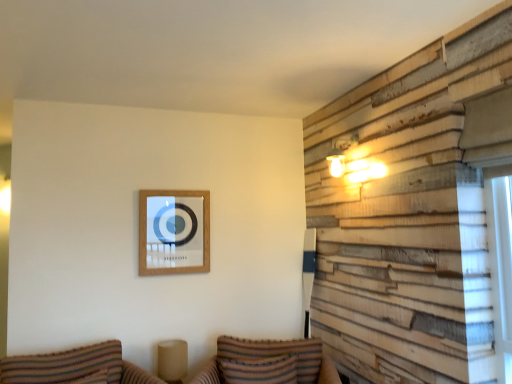
This screenshot has height=384, width=512. Identify the location of striped fabric couch at lower left, acting as the first couch starting from the left. (75, 367).

Describe the element at coordinates (269, 359) in the screenshot. Image resolution: width=512 pixels, height=384 pixels. I see `striped fabric couch at lower center, the 2th couch when ordered from left to right` at that location.

You are a GUI agent. You are given a task and a screenshot of the screen. Output one action in this format:
    pyautogui.click(x=<x>, y=<y>)
    Task: Click on the wooden picture frame at upper center
    
    Given the screenshot: What is the action you would take?
    pyautogui.click(x=174, y=232)

Image resolution: width=512 pixels, height=384 pixels. In order to click on striped fabric couch at lower left, acting as the first couch starting from the left in this screenshot , I will do `click(75, 367)`.

Is striped fabric pillow at lower center a part of striped fabric couch at lower center, which is the first couch in right-to-left order?

Yes, striped fabric couch at lower center, which is the first couch in right-to-left order, is surrounding striped fabric pillow at lower center.

Is striped fabric couch at lower center, the 2th couch when ordered from left to right, wider than striped fabric pillow at lower center?

Correct, the width of striped fabric couch at lower center, the 2th couch when ordered from left to right, exceeds that of striped fabric pillow at lower center.

Does point (240, 346) appear closer or farther from the camera than point (252, 373)?

Point (240, 346).

From the image's perspective, which is above, striped fabric couch at lower center, the 2th couch when ordered from left to right, or striped fabric pillow at lower center?

striped fabric pillow at lower center is shown above in the image.

The image size is (512, 384). Find the location of `picture frame behind the striped fabric pillow at lower center`. picture frame behind the striped fabric pillow at lower center is located at coordinates (174, 232).

Is striped fabric pillow at lower center located outside wooden picture frame at upper center?

That's correct, striped fabric pillow at lower center is outside of wooden picture frame at upper center.

From the picture: Which is further, (291,354) or (192,262)?

The point (192,262) is behind.

From the image's perspective, between striped fabric pillow at lower center and wooden picture frame at upper center, who is located below?

From the image's view, striped fabric pillow at lower center is below.

Would you consider wooden picture frame at upper center to be distant from striped fabric couch at lower center, the 2th couch when ordered from left to right?

That's not correct — wooden picture frame at upper center is a little close to striped fabric couch at lower center, the 2th couch when ordered from left to right.

Between wooden picture frame at upper center and striped fabric couch at lower center, the 2th couch when ordered from left to right, which one has larger size?

striped fabric couch at lower center, the 2th couch when ordered from left to right, is bigger.

I want to click on couch that is the 1st one when counting forward from the wooden picture frame at upper center, so click(269, 359).

Could you tell me if wooden picture frame at upper center is facing striped fabric couch at lower center, which is the first couch in right-to-left order?

No, wooden picture frame at upper center does not turn towards striped fabric couch at lower center, which is the first couch in right-to-left order.

Is striped fabric couch at lower left, acting as the first couch starting from the left, facing towards wooden picture frame at upper center?

No.

In terms of size, does striped fabric couch at lower left, acting as the first couch starting from the left, appear bigger or smaller than wooden picture frame at upper center?

Clearly, striped fabric couch at lower left, acting as the first couch starting from the left, is larger in size than wooden picture frame at upper center.

In the scene shown: Which is closer, (140, 370) or (169, 253)?

Clearly, point (140, 370) is closer to the camera than point (169, 253).

From the image's perspective, which one is positioned lower, striped fabric couch at lower left, which is counted as the 2th couch, starting from the right, or wooden picture frame at upper center?

striped fabric couch at lower left, which is counted as the 2th couch, starting from the right.

From a real-world perspective, which object rests below the other?

striped fabric pillow at lower center, from a real-world perspective.

Can we say wooden picture frame at upper center lies outside striped fabric pillow at lower center?

Yes, wooden picture frame at upper center is not within striped fabric pillow at lower center.

Visually, is wooden picture frame at upper center positioned to the left or to the right of striped fabric pillow at lower center?

From the image, it's evident that wooden picture frame at upper center is to the left of striped fabric pillow at lower center.

At what (x,y) coordinates should I click in order to perform the action: click on picture frame behind the striped fabric pillow at lower center. Please return your answer as a coordinate pair (x, y). The image size is (512, 384). Looking at the image, I should click on (174, 232).

Which of these two, striped fabric pillow at lower center or striped fabric couch at lower center, the 2th couch when ordered from left to right, is wider?

striped fabric couch at lower center, the 2th couch when ordered from left to right, is wider.

Is striped fabric pillow at lower center directly adjacent to striped fabric couch at lower center, which is the first couch in right-to-left order?

Yes, striped fabric pillow at lower center is in contact with striped fabric couch at lower center, which is the first couch in right-to-left order.

Considering their positions, is striped fabric pillow at lower center located in front of or behind striped fabric couch at lower center, the 2th couch when ordered from left to right?

striped fabric pillow at lower center is positioned farther from the viewer than striped fabric couch at lower center, the 2th couch when ordered from left to right.

Which is closer to the camera, (296, 362) or (205, 271)?

The point (296, 362) is closer to the camera.

Looking at this image, how different are the orientations of striped fabric couch at lower center, which is the first couch in right-to-left order, and wooden picture frame at upper center in degrees?

26.3 degrees separate the facing orientations of striped fabric couch at lower center, which is the first couch in right-to-left order, and wooden picture frame at upper center.

Considering the relative sizes of striped fabric couch at lower center, the 2th couch when ordered from left to right, and wooden picture frame at upper center in the image provided, is striped fabric couch at lower center, the 2th couch when ordered from left to right, taller than wooden picture frame at upper center?

Incorrect, the height of striped fabric couch at lower center, the 2th couch when ordered from left to right, is not larger of that of wooden picture frame at upper center.

Locate an element on the screen. The width and height of the screenshot is (512, 384). couch that is the 2nd object located below the wooden picture frame at upper center (from the image's perspective) is located at coordinates (269, 359).

Find the location of `pillow above the striped fabric couch at lower center, which is the first couch in right-to-left order (from a real-world perspective)`. pillow above the striped fabric couch at lower center, which is the first couch in right-to-left order (from a real-world perspective) is located at coordinates (259, 370).

Identify the location of picture frame on the left side of striped fabric pillow at lower center. This screenshot has width=512, height=384. [174, 232].

Which object lies nearer to the anchor point striped fabric couch at lower center, which is the first couch in right-to-left order, striped fabric pillow at lower center or striped fabric couch at lower left, acting as the first couch starting from the left?

striped fabric pillow at lower center.

In the scene shown: From the image, which object appears to be nearer to striped fabric pillow at lower center, wooden picture frame at upper center or striped fabric couch at lower center, which is the first couch in right-to-left order?

striped fabric couch at lower center, which is the first couch in right-to-left order, is positioned closer to the anchor striped fabric pillow at lower center.

When comparing their distances from striped fabric couch at lower left, acting as the first couch starting from the left, does wooden picture frame at upper center or striped fabric pillow at lower center seem closer?

striped fabric pillow at lower center lies closer to striped fabric couch at lower left, acting as the first couch starting from the left, than the other object.

In the scene shown: Considering their positions, is striped fabric pillow at lower center positioned closer to wooden picture frame at upper center than striped fabric couch at lower center, the 2th couch when ordered from left to right?

The object closer to wooden picture frame at upper center is striped fabric couch at lower center, the 2th couch when ordered from left to right.

Considering their positions, is striped fabric couch at lower center, the 2th couch when ordered from left to right, positioned closer to striped fabric pillow at lower center than striped fabric couch at lower left, acting as the first couch starting from the left?

striped fabric couch at lower center, the 2th couch when ordered from left to right, is closer to striped fabric pillow at lower center.

Based on the photo, considering their positions, is striped fabric couch at lower center, which is the first couch in right-to-left order, positioned further to wooden picture frame at upper center than striped fabric pillow at lower center?

Based on the image, striped fabric pillow at lower center appears to be further to wooden picture frame at upper center.

Considering their positions, is striped fabric couch at lower left, which is counted as the 2th couch, starting from the right, positioned further to striped fabric pillow at lower center than striped fabric couch at lower center, which is the first couch in right-to-left order?

striped fabric couch at lower left, which is counted as the 2th couch, starting from the right, is further to striped fabric pillow at lower center.

From the image, which object appears to be nearer to striped fabric pillow at lower center, striped fabric couch at lower left, acting as the first couch starting from the left, or wooden picture frame at upper center?

The object closer to striped fabric pillow at lower center is striped fabric couch at lower left, acting as the first couch starting from the left.

Identify the location of pillow positioned between striped fabric couch at lower center, the 2th couch when ordered from left to right, and wooden picture frame at upper center from near to far. (259, 370).

I want to click on couch located between striped fabric couch at lower left, which is counted as the 2th couch, starting from the right, and wooden picture frame at upper center in the depth direction, so click(269, 359).

The width and height of the screenshot is (512, 384). Identify the location of pillow situated between striped fabric couch at lower left, which is counted as the 2th couch, starting from the right, and striped fabric couch at lower center, the 2th couch when ordered from left to right, from left to right. (259, 370).

You are a GUI agent. You are given a task and a screenshot of the screen. Output one action in this format:
    pyautogui.click(x=<x>, y=<y>)
    Task: Click on the pillow between striped fabric couch at lower left, acting as the first couch starting from the left, and wooden picture frame at upper center from front to back
    The height and width of the screenshot is (384, 512).
    Given the screenshot: What is the action you would take?
    pyautogui.click(x=259, y=370)